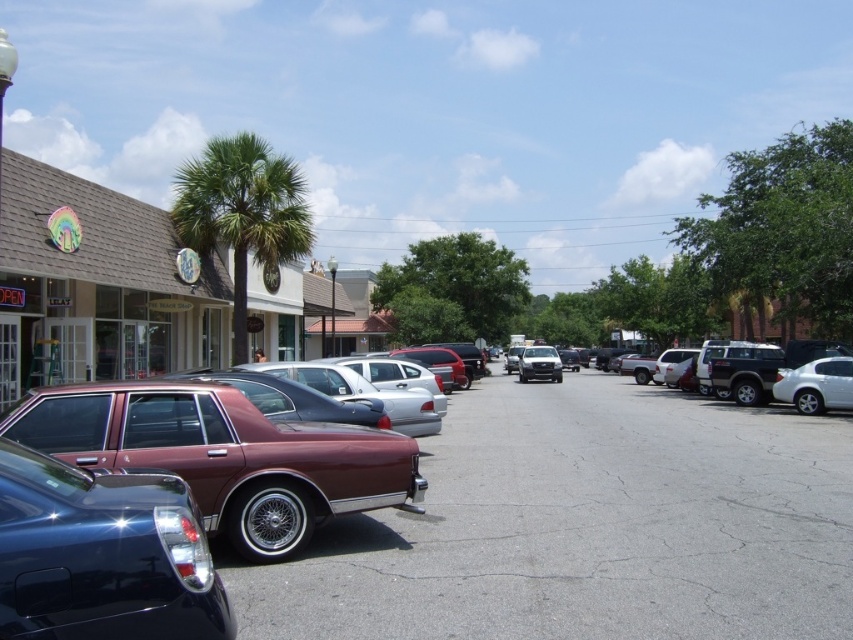
Which is below, white glossy sedan at right or satin silver sedan at center?

satin silver sedan at center is below.

Is white glossy sedan at right shorter than satin silver sedan at center?

Indeed, white glossy sedan at right has a lesser height compared to satin silver sedan at center.

Is point (802, 372) positioned after point (553, 369)?

That is False.

Find the location of `white glossy sedan at right`. white glossy sedan at right is located at coordinates (816, 385).

Can you confirm if shiny metallic car at center is thinner than green leafy palm tree at center?

Yes.

Who is more distant from viewer, (x=677, y=408) or (x=265, y=209)?

The point (x=677, y=408) is behind.

Between point (370, 557) and point (286, 211), which one is positioned behind?

The point (286, 211) is behind.

The image size is (853, 640). I want to click on shiny metallic car at center, so 587,528.

Image resolution: width=853 pixels, height=640 pixels. In order to click on beige stucco building at left in this screenshot , I will do tap(97, 285).

Is beige stucco building at left wider than satin silver sedan at center?

No.

Between point (12, 150) and point (550, 358), which one is positioned behind?

Point (550, 358)

Locate an element on the screen. beige stucco building at left is located at coordinates (97, 285).